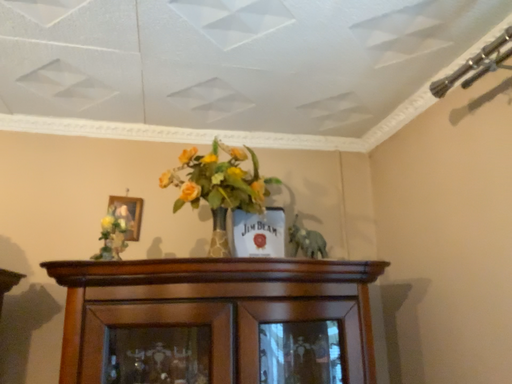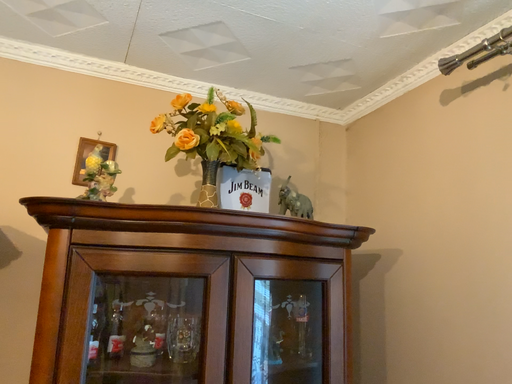
Question: How did the camera likely rotate when shooting the video?

Choices:
 (A) rotated left
 (B) rotated right

Answer: (B)